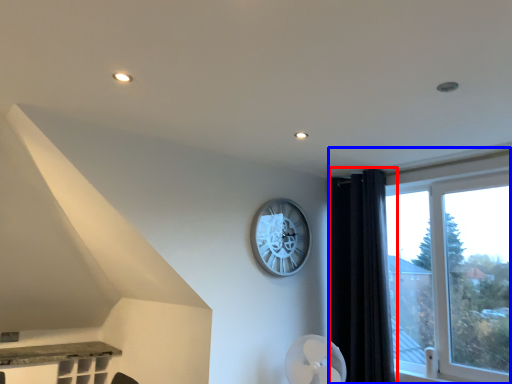
Question: Which of the following is the closest to the observer, curtain (highlighted by a red box) or window (highlighted by a blue box)?

Choices:
 (A) curtain
 (B) window

Answer: (B)